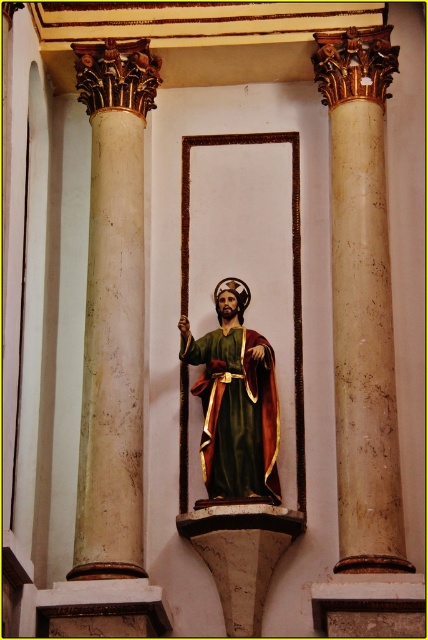
Does beige marble column at right appear over beige marble column at left?

No, beige marble column at right is not above beige marble column at left.

At what (x,y) coordinates should I click in order to perform the action: click on beige marble column at right. Please return your answer as a coordinate pair (x, y). Looking at the image, I should click on (362, 300).

Is beige marble column at left smaller than green velvet robe at center?

No, beige marble column at left is not smaller than green velvet robe at center.

Is beige marble column at left closer to the viewer compared to green velvet robe at center?

Yes.

Is point (136, 205) positioned in front of point (255, 490)?

No.

Locate an element on the screen. Image resolution: width=428 pixels, height=640 pixels. beige marble column at left is located at coordinates (112, 310).

In the scene shown: Can you confirm if beige marble column at right is smaller than green velvet robe at center?

No, beige marble column at right is not smaller than green velvet robe at center.

Does beige marble column at right appear over green velvet robe at center?

Indeed, beige marble column at right is positioned over green velvet robe at center.

Which is in front, point (395, 508) or point (234, 477)?

Point (395, 508) is in front.

Locate an element on the screen. beige marble column at right is located at coordinates (362, 300).